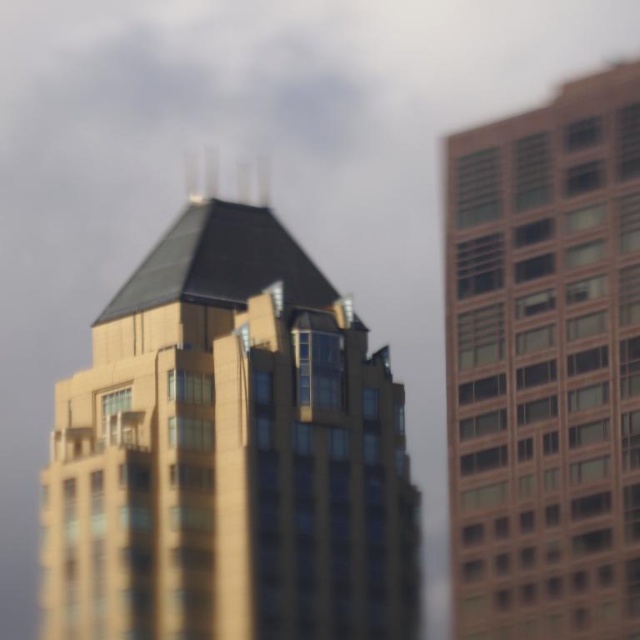
Question: Which object is closer to the camera taking this photo?

Choices:
 (A) gold glass building at center
 (B) brown brick building at right

Answer: (B)

Question: Which point is closer to the camera?

Choices:
 (A) gold glass building at center
 (B) brown brick building at right

Answer: (B)

Question: Can you confirm if gold glass building at center is positioned to the right of brown brick building at right?

Choices:
 (A) yes
 (B) no

Answer: (B)

Question: Can you confirm if gold glass building at center is smaller than brown brick building at right?

Choices:
 (A) no
 (B) yes

Answer: (A)

Question: Does gold glass building at center appear on the right side of brown brick building at right?

Choices:
 (A) yes
 (B) no

Answer: (B)

Question: Among these objects, which one is farthest from the camera?

Choices:
 (A) brown brick building at right
 (B) gold glass building at center

Answer: (B)